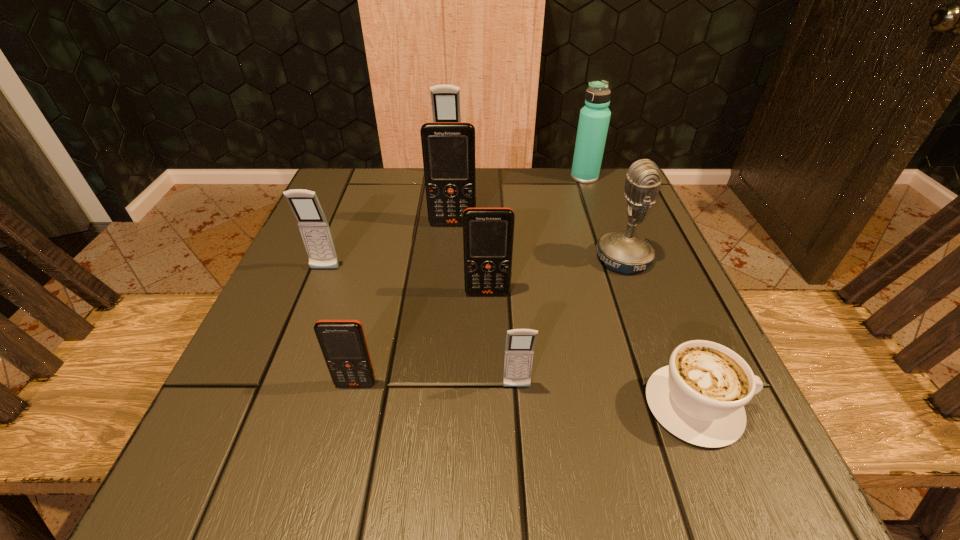
Find the location of a particular element. The image size is (960, 540). gray cellular telephone that is the second closest to the shortest object is located at coordinates (313, 225).

You are a GUI agent. You are given a task and a screenshot of the screen. Output one action in this format:
    pyautogui.click(x=<x>, y=<y>)
    Task: Click on the second closest orange cellular telephone to the third farthest object
    Image resolution: width=960 pixels, height=540 pixels.
    Given the screenshot: What is the action you would take?
    pyautogui.click(x=343, y=344)

Select which orange cellular telephone is the second closest to the leftmost orange cellular telephone. Please provide its 2D coordinates. Your answer should be formatted as a tuple, i.e. [(x, y)], where the tuple contains the x and y coordinates of a point satisfying the conditions above.

[(448, 148)]

The height and width of the screenshot is (540, 960). In order to click on blank area in the image that satisfies the following two spatial constraints: 1. on the front-facing side of the microphone; 2. on the screen of the fourth farthest cellular telephone in this screenshot , I will do point(636,293).

The width and height of the screenshot is (960, 540). I want to click on vacant position in the image that satisfies the following two spatial constraints: 1. on the front-facing side of the microphone; 2. on the screen of the nearest orange cellular telephone, so click(671, 384).

The height and width of the screenshot is (540, 960). I want to click on free location that satisfies the following two spatial constraints: 1. on the front-facing side of the microphone; 2. on the front-facing side of the third farthest cellular telephone, so click(628, 269).